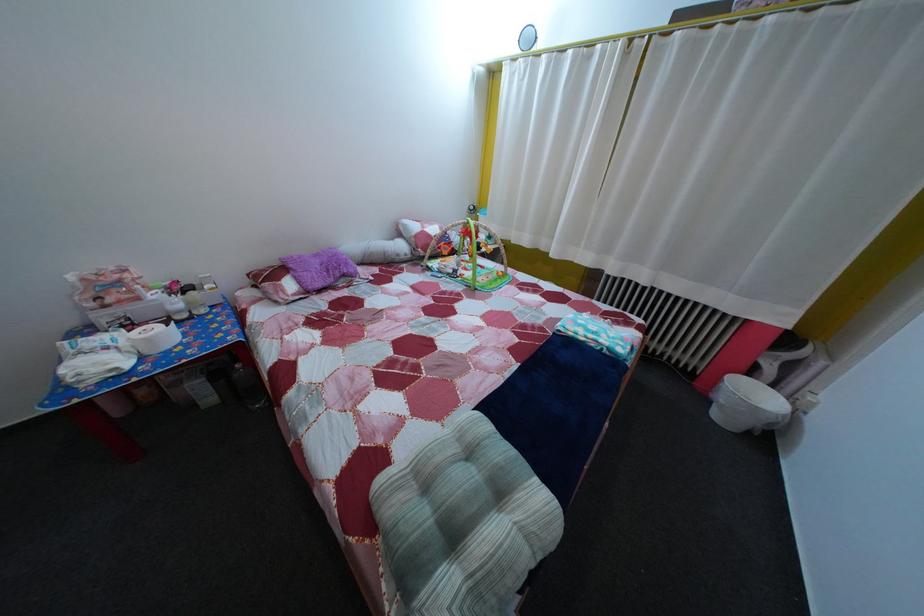
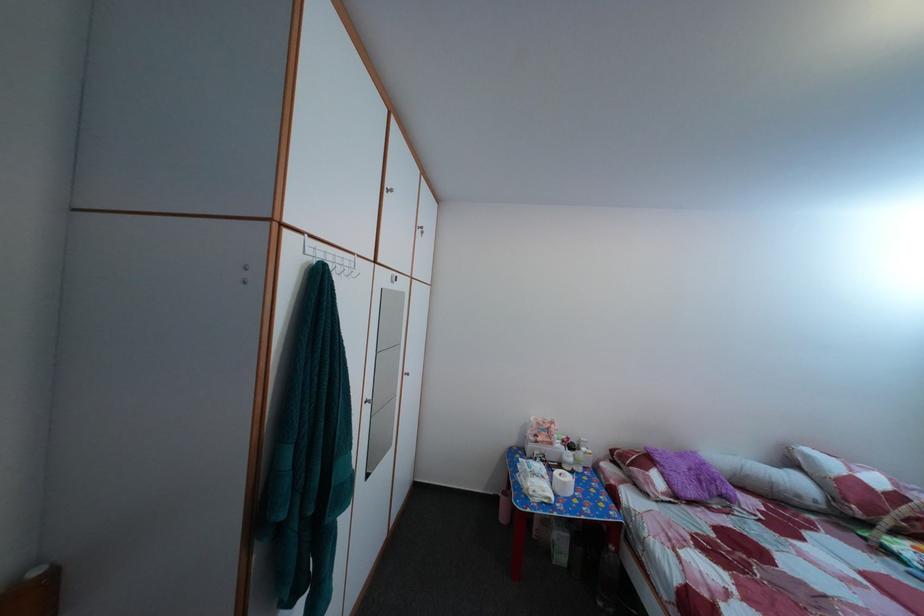
In the second image, find the point that corresponds to pixel 185 291 in the first image.

(578, 447)